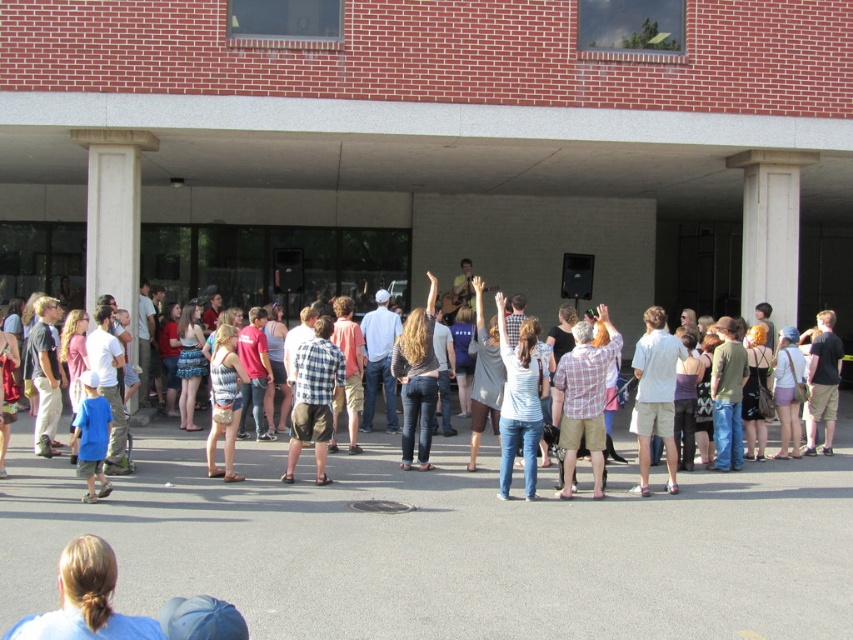
Does denim jeans at center have a greater height compared to white concrete column at center?

Incorrect, denim jeans at center's height is not larger of white concrete column at center's.

Which is behind, point (22, 451) or point (747, 259)?

The point (747, 259) is more distant.

This screenshot has height=640, width=853. I want to click on denim jeans at center, so [401, 486].